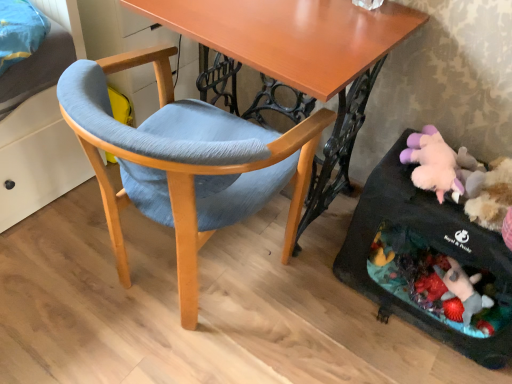
Locate an element on the screen. The width and height of the screenshot is (512, 384). blank space situated above wooden desk at center (from a real-world perspective) is located at coordinates (296, 24).